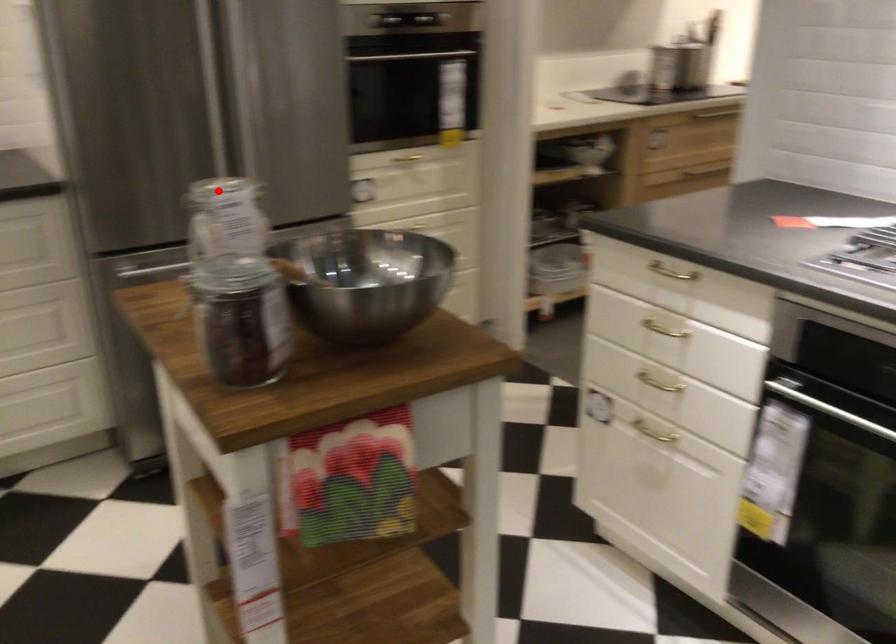
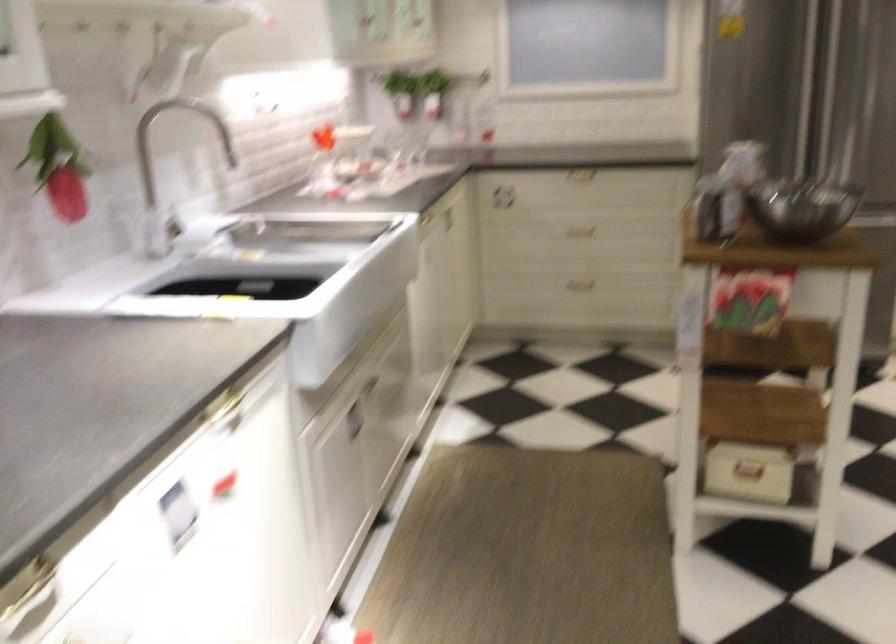
Question: A red point is marked in image1. In image2, is the corresponding 3D point closer to the camera or farther? Reply with the corresponding letter.

Choices:
 (A) The corresponding 3D point is closer.
 (B) The corresponding 3D point is farther.

Answer: (B)